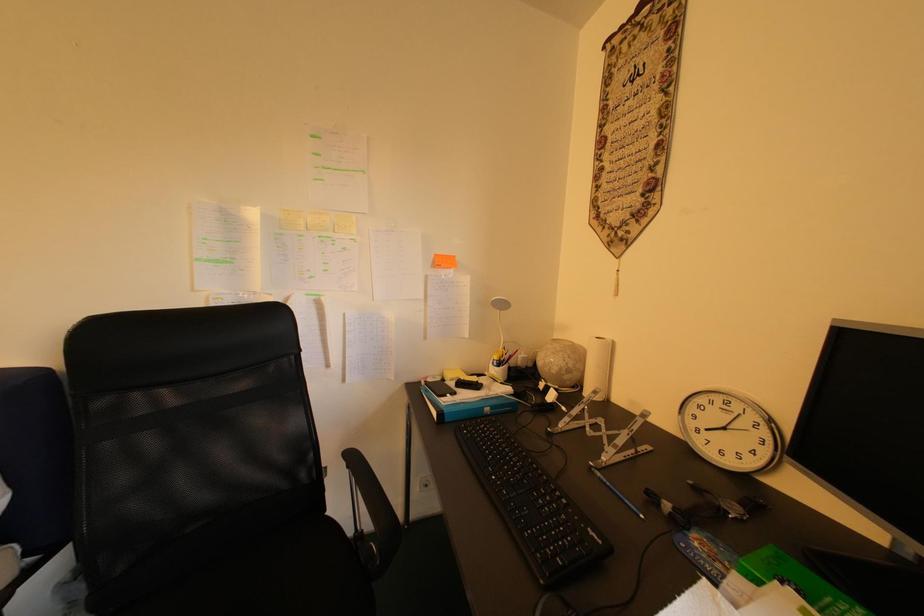
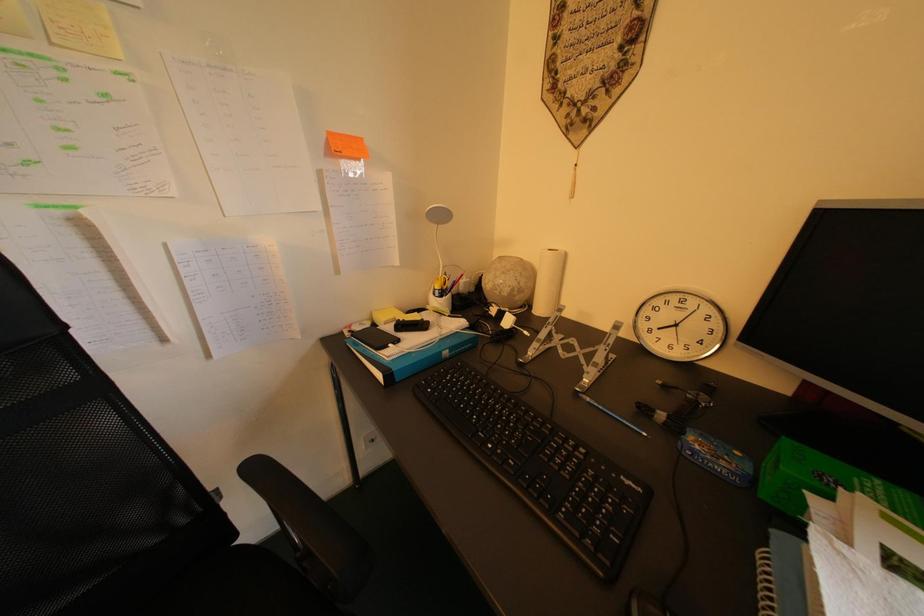
From the picture: Based on the continuous images, in which direction is the camera rotating?

The rotation direction of the camera is right-down.